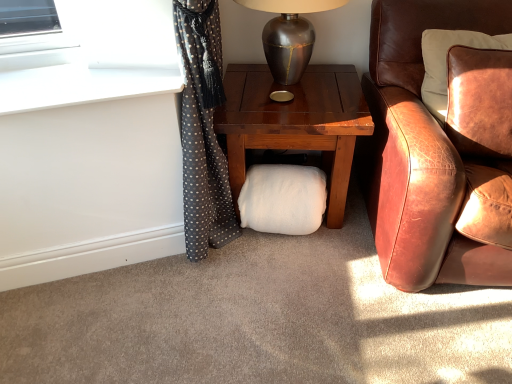
What are the coordinates of `vacant area on top of white smooth window sill at upper left (from a real-world perspective)` in the screenshot? It's located at (80, 72).